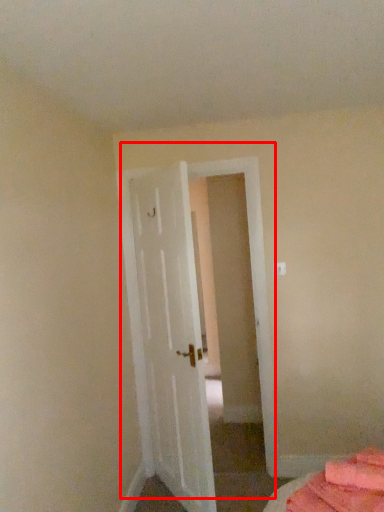
Question: Observing the image, what is the correct spatial positioning of door (annotated by the red box) in reference to bed?

Choices:
 (A) left
 (B) right

Answer: (A)